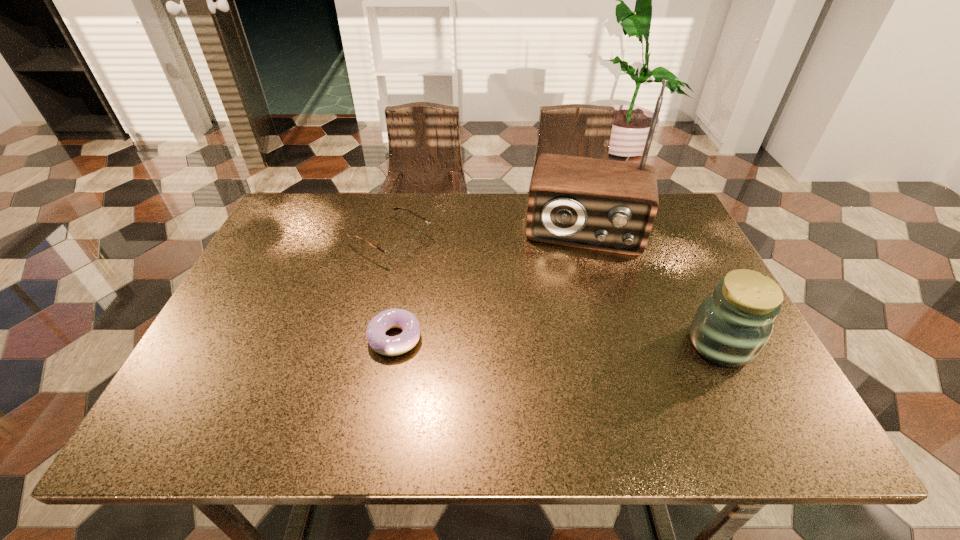
You are a GUI agent. You are given a task and a screenshot of the screen. Output one action in this format:
    pyautogui.click(x=<x>, y=<y>)
    Task: Click on the doughnut
    The image size is (960, 540).
    Given the screenshot: What is the action you would take?
    pyautogui.click(x=385, y=345)

Find the location of `the third shortest object`. the third shortest object is located at coordinates (731, 326).

Locate an element on the screen. the tallest object is located at coordinates (606, 205).

Locate an element on the screen. The width and height of the screenshot is (960, 540). spectacles is located at coordinates (398, 252).

Identify the location of vacant space located on the right of the doughnut. (527, 338).

Identify the location of free space located on the back of the second tallest object. (696, 296).

Where is `vacant region located 0.250m on the front-facing side of the radio receiver`? The image size is (960, 540). vacant region located 0.250m on the front-facing side of the radio receiver is located at coordinates (570, 325).

This screenshot has height=540, width=960. I want to click on vacant space located 0.340m on the front-facing side of the radio receiver, so click(x=566, y=355).

Where is `free spot located on the front-facing side of the radio receiver`? free spot located on the front-facing side of the radio receiver is located at coordinates (565, 366).

Locate an element on the screen. The height and width of the screenshot is (540, 960). vacant space situated 0.050m on the front-facing side of the third tallest object is located at coordinates click(x=435, y=265).